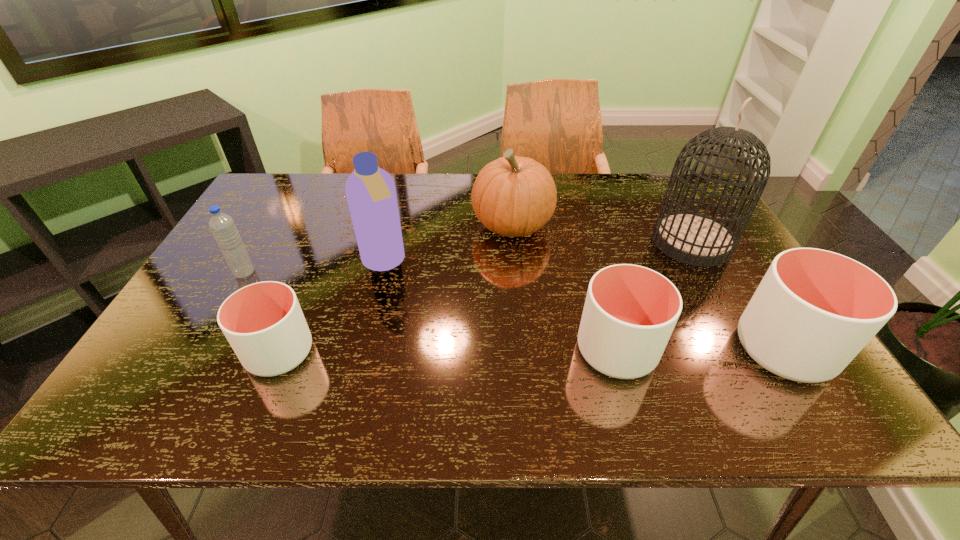
Find the location of a particular element. object that is at the left edge is located at coordinates (222, 226).

Locate an element on the screen. This screenshot has width=960, height=540. cup located in the right edge section of the desktop is located at coordinates (814, 310).

The width and height of the screenshot is (960, 540). Identify the location of birdcage at the right edge. pyautogui.click(x=692, y=238).

The width and height of the screenshot is (960, 540). I want to click on object located in the near right corner section of the desktop, so click(814, 310).

Locate an element on the screen. This screenshot has height=540, width=960. vacant space at the far edge is located at coordinates (637, 178).

This screenshot has height=540, width=960. Identify the location of free space at the near edge of the desktop. (686, 367).

Image resolution: width=960 pixels, height=540 pixels. Find the location of `free space at the left edge`. free space at the left edge is located at coordinates (199, 287).

At what (x,y) coordinates should I click in order to perform the action: click on free region at the right edge of the desktop. Please return your answer as a coordinate pair (x, y). The height and width of the screenshot is (540, 960). Looking at the image, I should click on (725, 292).

In the image, there is a desktop. Find the location of `free space at the far left corner`. free space at the far left corner is located at coordinates pyautogui.click(x=259, y=192).

I want to click on free area in between the second shortest cup and the fifth shortest object, so pyautogui.click(x=564, y=287).